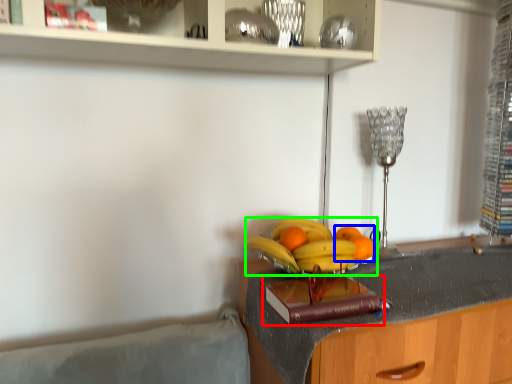
Question: Which object is the farthest from book (highlighted by a red box)? Choose among these: citrus fruit (highlighted by a blue box) or banana (highlighted by a green box).

Choices:
 (A) citrus fruit
 (B) banana

Answer: (A)